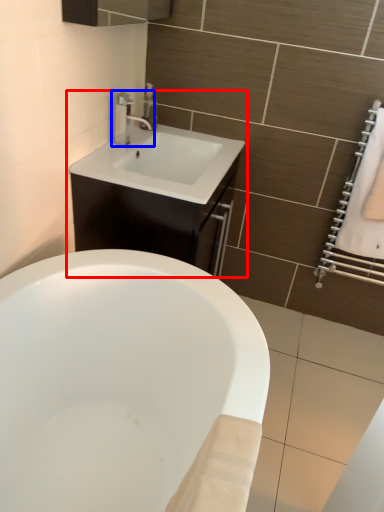
Question: Among these objects, which one is nearest to the camera, bathroom cabinet (highlighted by a red box) or tap (highlighted by a blue box)?

Choices:
 (A) bathroom cabinet
 (B) tap

Answer: (A)